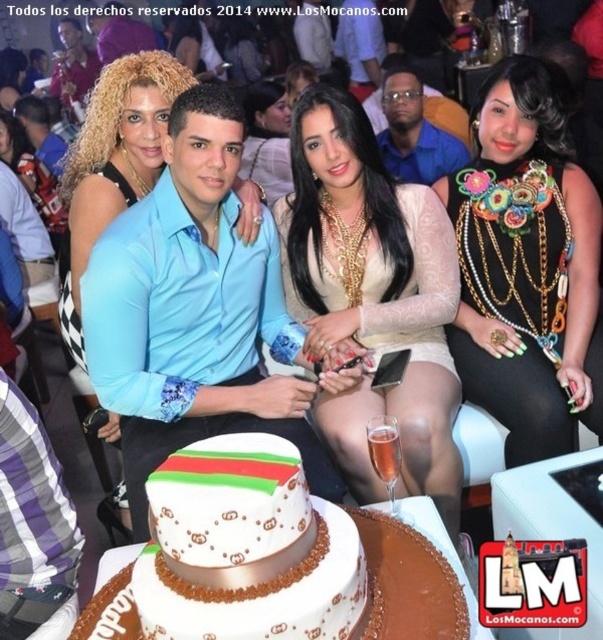
Between white lace dress at center and black fabric dress at center, which one has less height?

Standing shorter between the two is black fabric dress at center.

Is white lace dress at center wider than black fabric dress at center?

Indeed, white lace dress at center has a greater width compared to black fabric dress at center.

You are a GUI agent. You are given a task and a screenshot of the screen. Output one action in this format:
    pyautogui.click(x=<x>, y=<y>)
    Task: Click on the white lace dress at center
    Image resolution: width=603 pixels, height=640 pixels.
    Given the screenshot: What is the action you would take?
    pyautogui.click(x=373, y=296)

Which is more to the right, light blue shirt at center or black fabric dress at center?

Positioned to the right is black fabric dress at center.

How much distance is there between light blue shirt at center and black fabric dress at center?

A distance of 33.20 inches exists between light blue shirt at center and black fabric dress at center.

The image size is (603, 640). I want to click on light blue shirt at center, so click(194, 310).

Is point (414, 442) farther from camera compared to point (414, 164)?

That is False.

Who is shorter, white lace dress at center or blue shirt at center?

blue shirt at center

Locate an element on the screen. The image size is (603, 640). white lace dress at center is located at coordinates point(373,296).

The image size is (603, 640). I want to click on white lace dress at center, so click(373, 296).